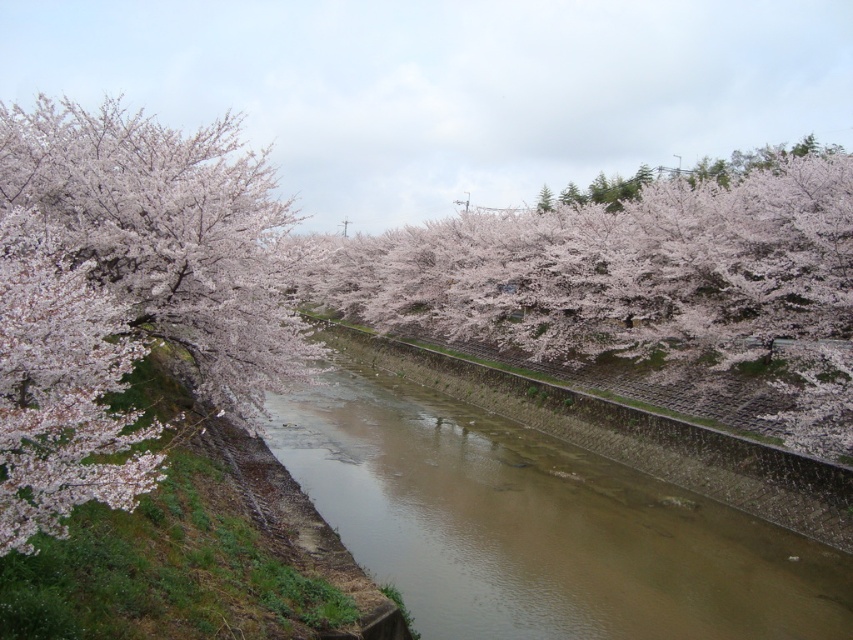
Question: Does brown concrete river at center have a greater width compared to pink blossoms at left?

Choices:
 (A) no
 (B) yes

Answer: (A)

Question: Does pink blossoms at center appear on the right side of pink blossoms at left?

Choices:
 (A) yes
 (B) no

Answer: (A)

Question: Which point is closer to the camera?

Choices:
 (A) pink blossoms at center
 (B) pink blossoms at left

Answer: (B)

Question: Among these objects, which one is nearest to the camera?

Choices:
 (A) brown concrete river at center
 (B) pink blossoms at center
 (C) pink blossoms at left

Answer: (C)

Question: Can you confirm if brown concrete river at center is thinner than pink blossoms at left?

Choices:
 (A) no
 (B) yes

Answer: (B)

Question: Which point is closer to the camera taking this photo?

Choices:
 (A) (492, 516)
 (B) (160, 474)
 (C) (779, 260)

Answer: (B)